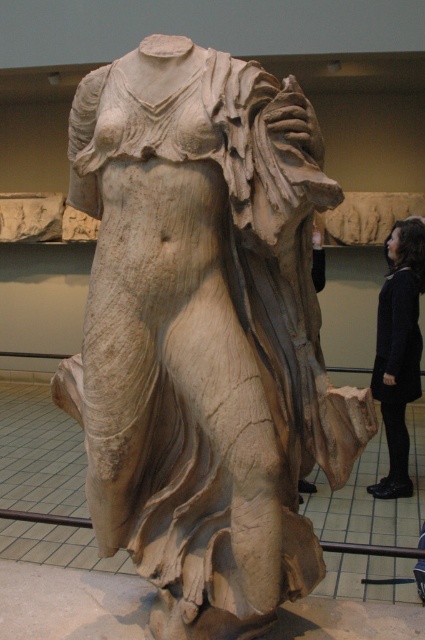
Consider the image. You are a museum curator planning to move the dark woolen sweater at center closer to the white marble statue at center so that they are only 1.5 meters apart. Given the current distance between them, will this adjustment require moving the sweater forward, backward, or sideways?

The white marble statue at center and dark woolen sweater at center are currently 2.72 meters apart. To reduce the distance to 1.5 meters, the sweater would need to be moved forward toward the statue, backward away from it, or sideways perpendicular to the line connecting them. However, without knowing their exact spatial orientation or the direction of the desired adjustment, it is impossible to determine the precise direction required. The question does not provide enough information about their relative

You are a museum security guard standing at the entrance of the room. You need to check if the white marble statue at center and the dark woolen sweater at center are positioned correctly according to the layout plan. According to the plan, the statue should be to the left of the sweater. Is this arrangement correct?

Yes, the arrangement is correct because the white marble statue at center is positioned to the left of the dark woolen sweater at center, as required by the layout plan.

You are standing in the museum and want to take a photo of the white marble statue at center. If you are at point 0.5, 0.5, which direction should you move to get a better view?

Since the white marble statue at center is located at point (204, 333), you should move slightly to the left and down from your current position at (212, 320) to center the statue in your viewfinder.